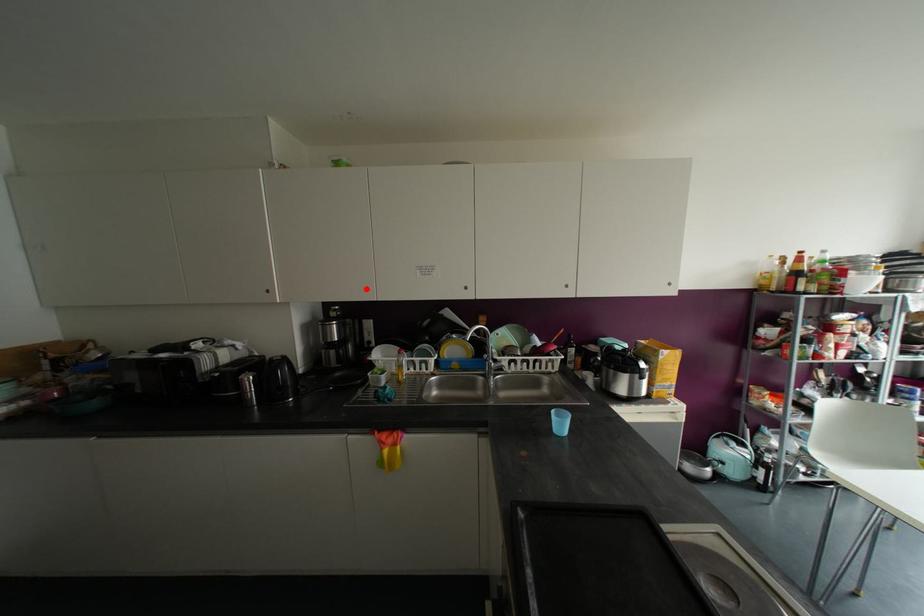
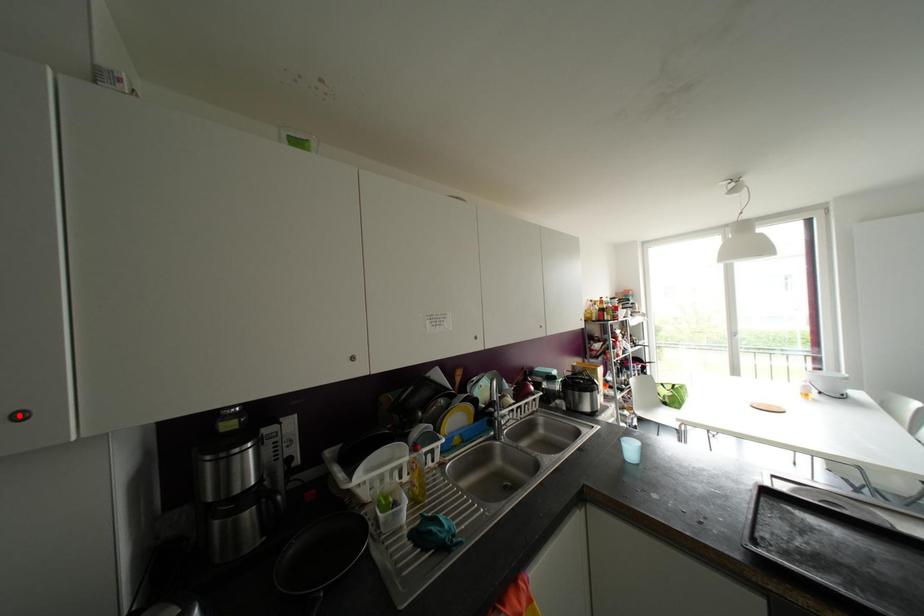
I am providing you with two images of the same scene from different viewpoints. A red point is marked on the first image and another point is marked on the second image. Do the highlighted points in image1 and image2 indicate the same real-world spot?

No